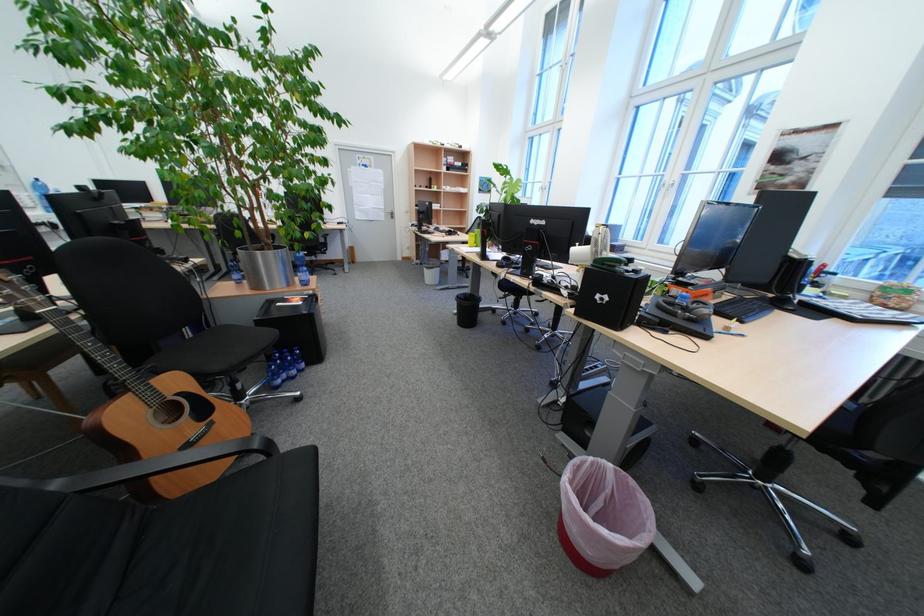
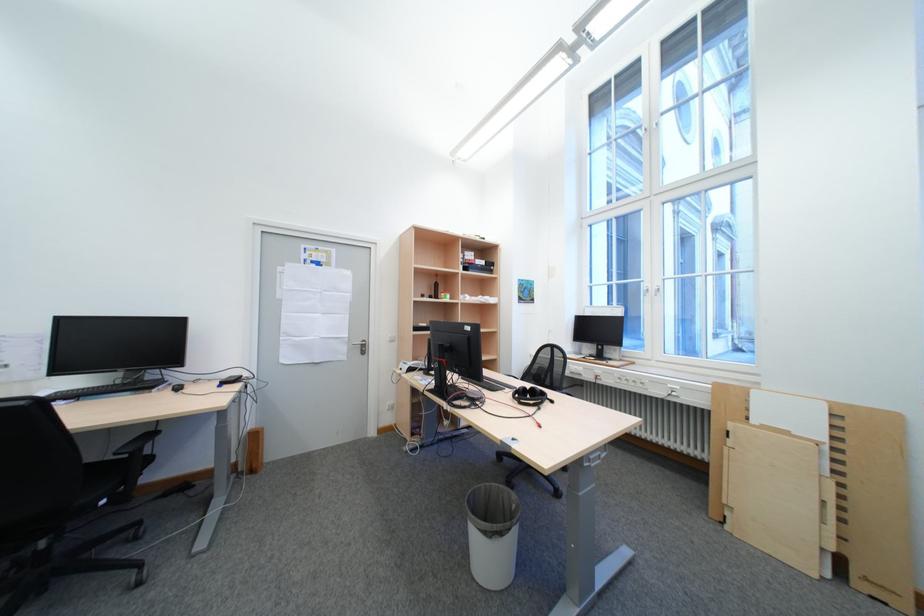
Where in the second image is the point corresponding to the point at 459,169 from the first image?

(477, 270)